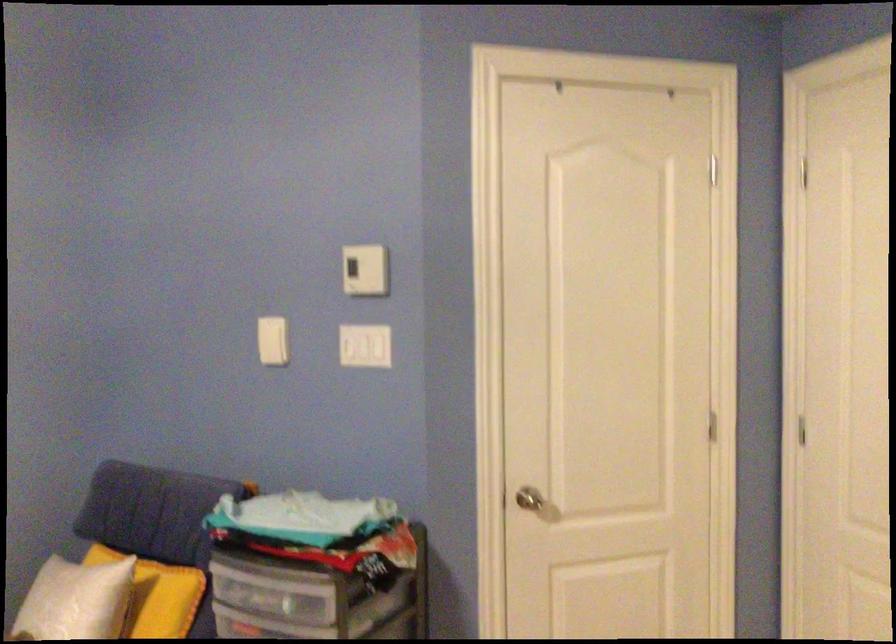
This screenshot has width=896, height=644. What do you see at coordinates (270, 592) in the screenshot?
I see `a plastic drawer handle` at bounding box center [270, 592].